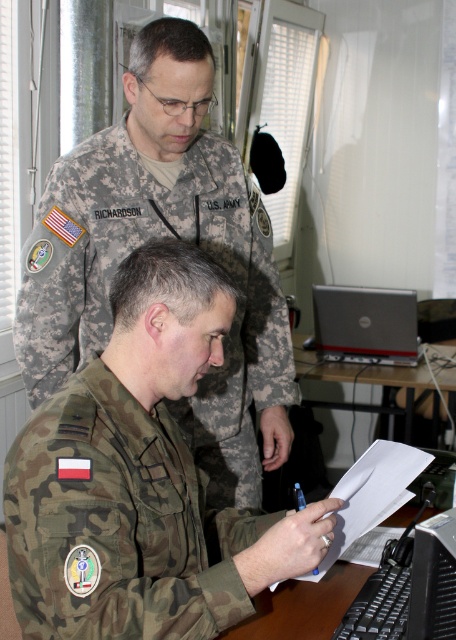
Does camo fabric uniform at lower left come behind black plastic keyboard at lower center?

Yes, it is behind black plastic keyboard at lower center.

Does point (248, 301) lie in front of point (447, 592)?

No, it is not.

Locate an element on the screen. The width and height of the screenshot is (456, 640). camo fabric uniform at lower left is located at coordinates (127, 253).

Which is above, black plastic keyboard at lower center or black plastic table at center?

black plastic table at center

This screenshot has width=456, height=640. What do you see at coordinates (409, 588) in the screenshot?
I see `black plastic keyboard at lower center` at bounding box center [409, 588].

Between point (449, 547) and point (438, 401), which one is positioned behind?

The point (438, 401) is behind.

In order to click on black plastic keyboard at lower center in this screenshot , I will do `click(409, 588)`.

From the picture: Is camo fabric uniform at lower center to the right of camo fabric uniform at lower left from the viewer's perspective?

Indeed, camo fabric uniform at lower center is positioned on the right side of camo fabric uniform at lower left.

This screenshot has height=640, width=456. What do you see at coordinates (118, 522) in the screenshot?
I see `camo fabric uniform at lower center` at bounding box center [118, 522].

You are a GUI agent. You are given a task and a screenshot of the screen. Output one action in this format:
    pyautogui.click(x=<x>, y=<y>)
    Task: Click on the camo fabric uniform at lower center
    The width and height of the screenshot is (456, 640).
    Given the screenshot: What is the action you would take?
    pyautogui.click(x=118, y=522)